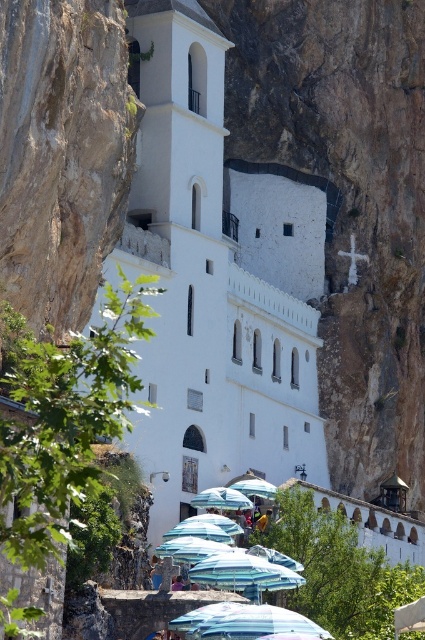
Based on the photo, you are standing at point A and want to reach the white smooth stone church at center. Which direction should you move in to get there?

The white smooth stone church at center is located at point (218, 276), so you should move towards that coordinate to reach it.

You are standing at the base of the cliff where the white smooth stone church at center is located. If you look towards the point marked by coordinates (218, 276), what structure would you see directly in front of you?

The white smooth stone church at center is located at the coordinates (218, 276), so looking towards that point would show the church directly in front of you.

You are a photographer planning to capture the white smooth stone church at center and the blue fabric umbrella at lower center in a single shot. Given that the church is larger than the umbrella, where should you position yourself to ensure both are visible in the frame?

To include both the white smooth stone church at center and the blue fabric umbrella at lower center in the frame, position yourself at a distance where the larger church fits within the shot while still capturing the smaller umbrella. Since the church is bigger, moving back slightly will help balance their sizes in the composition.